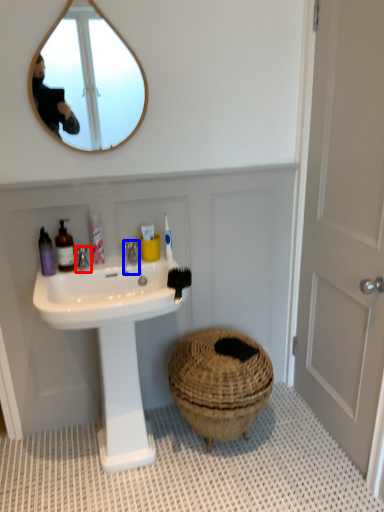
Question: Which of the following is the farthest to the observer, tap (highlighted by a red box) or faucet (highlighted by a blue box)?

Choices:
 (A) tap
 (B) faucet

Answer: (B)